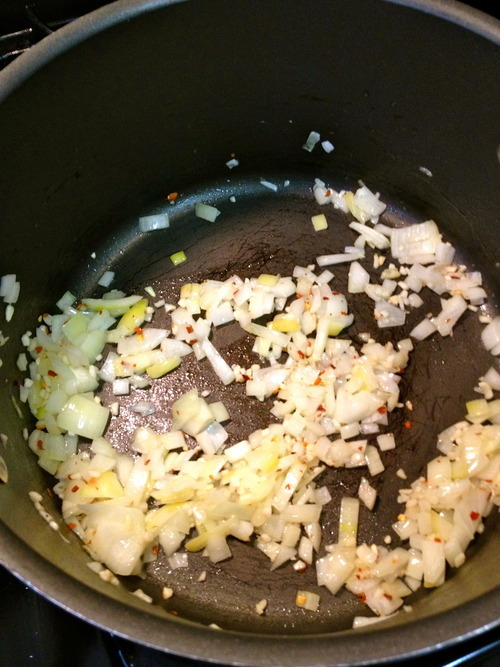
Find the location of a particular element. The height and width of the screenshot is (667, 500). partial view of cooking element is located at coordinates (12, 45).